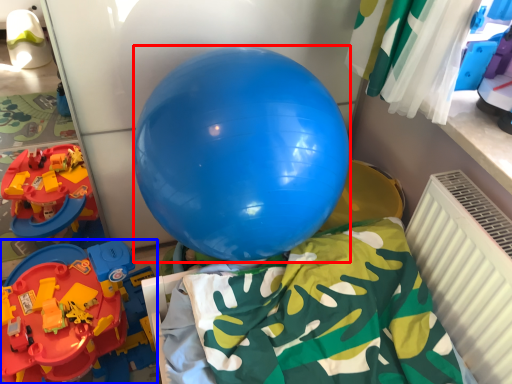
Question: Among these objects, which one is farthest to the camera, balloon (highlighted by a red box) or toy (highlighted by a blue box)?

Choices:
 (A) balloon
 (B) toy

Answer: (B)